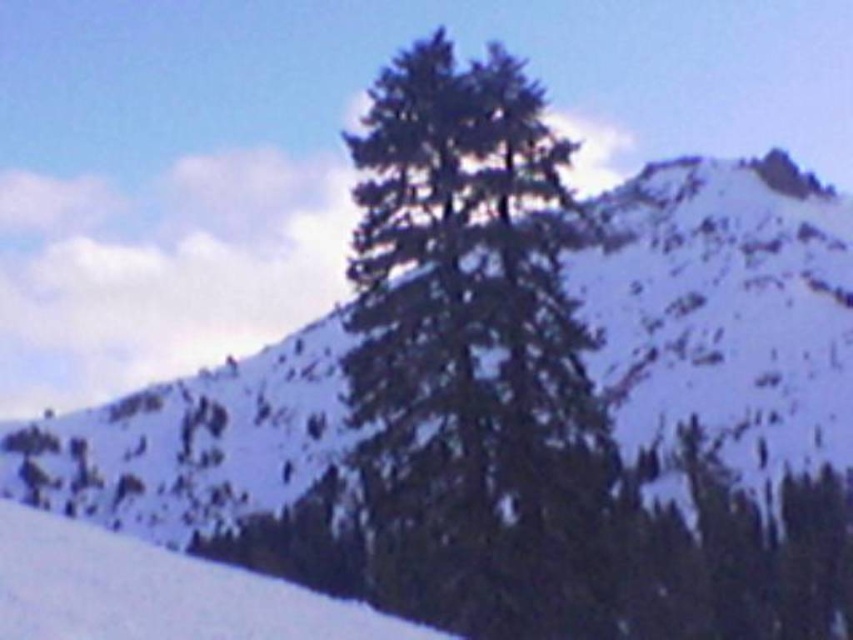
Question: Is the position of green textured tree at center less distant than that of white snow at lower left?

Choices:
 (A) yes
 (B) no

Answer: (B)

Question: Is green textured tree at center closer to the viewer compared to white snow at lower left?

Choices:
 (A) yes
 (B) no

Answer: (B)

Question: Does green textured tree at center have a lesser width compared to white snow at lower left?

Choices:
 (A) no
 (B) yes

Answer: (A)